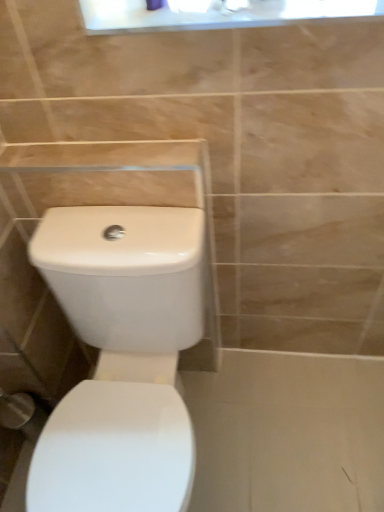
Question: Considering their positions, is white glossy toilet at center located in front of or behind white glossy medicine cabinet at upper center?

Choices:
 (A) behind
 (B) front

Answer: (B)

Question: Is white glossy toilet at center to the left or to the right of white glossy medicine cabinet at upper center in the image?

Choices:
 (A) right
 (B) left

Answer: (B)

Question: From a real-world perspective, is white glossy toilet at center physically located above or below white glossy medicine cabinet at upper center?

Choices:
 (A) below
 (B) above

Answer: (A)

Question: Is white glossy medicine cabinet at upper center taller or shorter than white glossy toilet at center?

Choices:
 (A) short
 (B) tall

Answer: (A)

Question: Considering their positions, is white glossy medicine cabinet at upper center located in front of or behind white glossy toilet at center?

Choices:
 (A) behind
 (B) front

Answer: (A)

Question: Is white glossy medicine cabinet at upper center situated inside white glossy toilet at center or outside?

Choices:
 (A) inside
 (B) outside

Answer: (B)

Question: From the image's perspective, relative to white glossy toilet at center, is white glossy medicine cabinet at upper center above or below?

Choices:
 (A) above
 (B) below

Answer: (A)